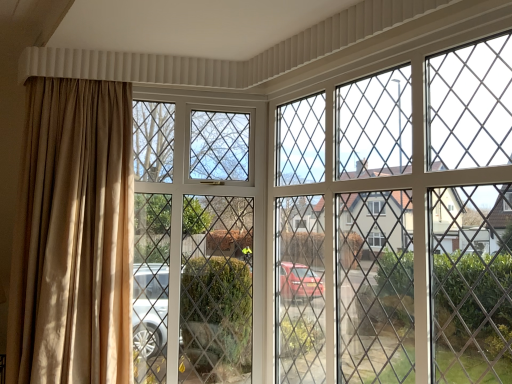
This screenshot has height=384, width=512. I want to click on free space above beige fabric curtain at left (from a real-world perspective), so click(87, 76).